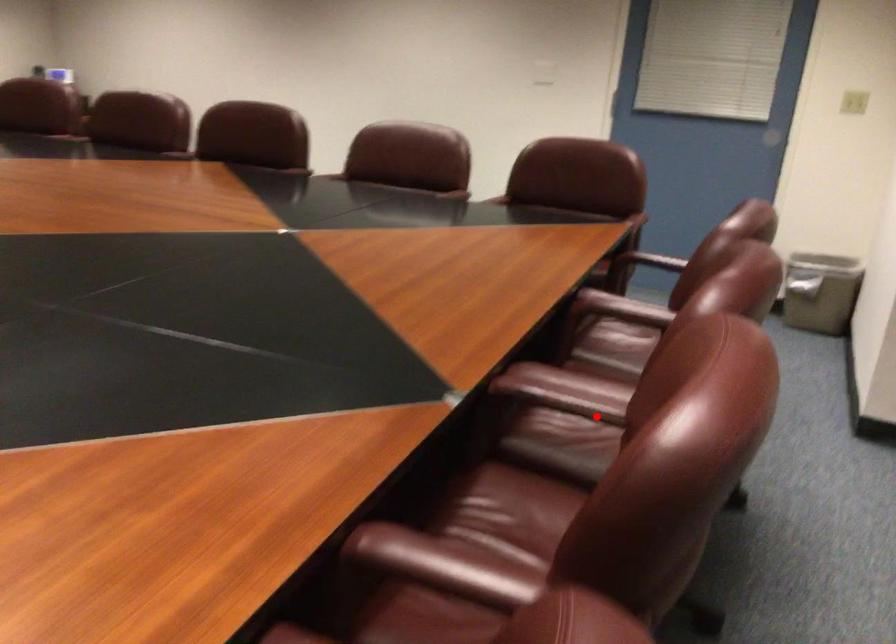
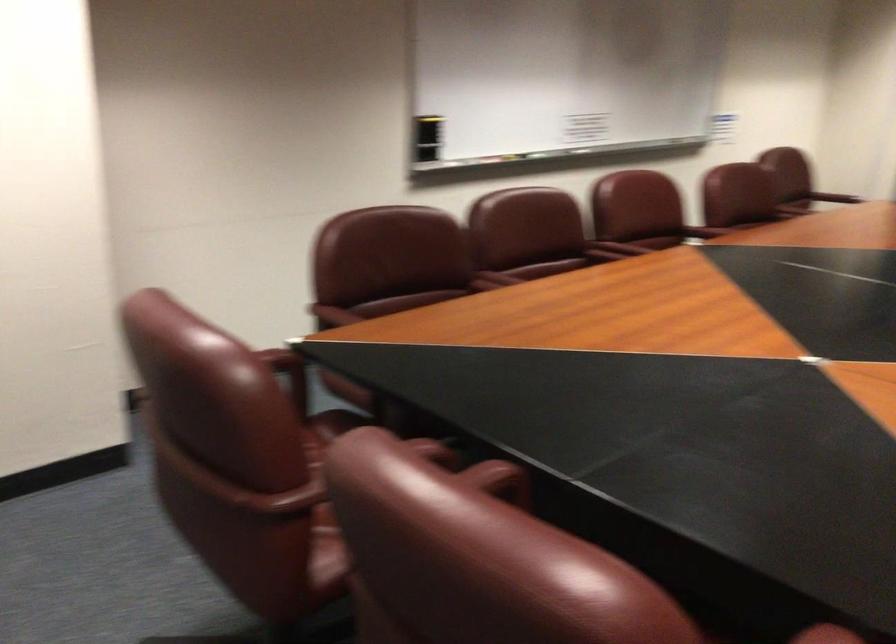
Question: A red point is marked in image1. In image2, is the corresponding 3D point closer to the camera or farther? Reply with the corresponding letter.

Choices:
 (A) The corresponding 3D point is closer.
 (B) The corresponding 3D point is farther.

Answer: (B)